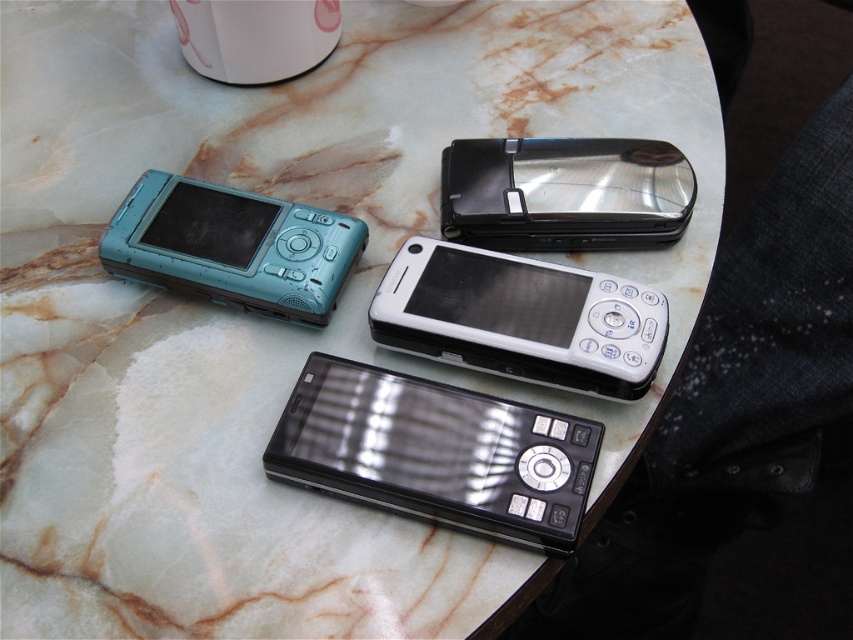
Which is in front, point (488, 531) or point (379, 285)?

Point (488, 531) is more forward.

I want to click on black glossy smartphone at center, so click(x=434, y=452).

Does black glossy smartphone at center lie in front of metallic silver flip phone at upper right?

Yes, it is.

Is point (463, 397) positioned in front of point (531, 170)?

That is True.

Identify the location of black glossy smartphone at center. (434, 452).

The height and width of the screenshot is (640, 853). What do you see at coordinates (434, 452) in the screenshot?
I see `black glossy smartphone at center` at bounding box center [434, 452].

Consider the image. Measure the distance between point (473, 460) and camera.

71.22 centimeters

You are a GUI agent. You are given a task and a screenshot of the screen. Output one action in this format:
    pyautogui.click(x=<x>, y=<y>)
    Task: Click on the black glossy smartphone at center
    
    Given the screenshot: What is the action you would take?
    pyautogui.click(x=434, y=452)